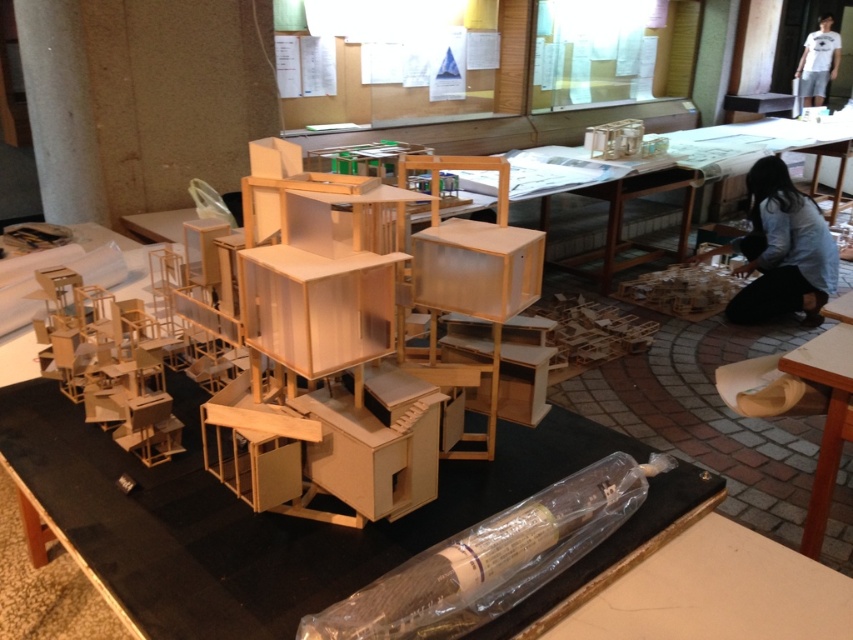
You are standing in the workspace and want to hand a blueprint to the person wearing the light blue shirt at lower right. Since you are holding the blueprint in your hand, can you directly place it on the wooden table at lower right without moving your hand past the person?

The light blue shirt at lower right is further to the viewer than wooden table at lower right, so the person is closer to you than the table. Therefore, you would need to move your hand past the person to reach the table behind them.